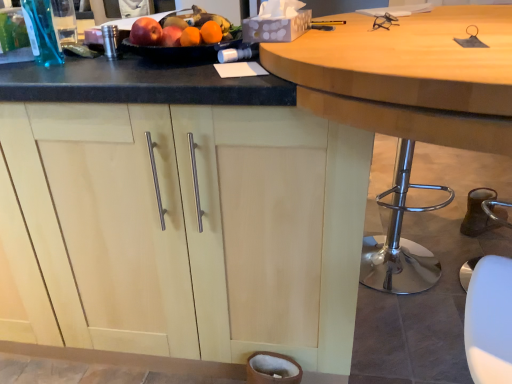
Where is `light wood cabinet at center`? The height and width of the screenshot is (384, 512). light wood cabinet at center is located at coordinates (185, 230).

Does light wood cabinet at center have a greater height compared to wooden table at center?

No, light wood cabinet at center is not taller than wooden table at center.

From a real-world perspective, between light wood cabinet at center and wooden table at center, who is vertically higher?

wooden table at center.

Looking at this image, does light wood cabinet at center have a smaller size compared to wooden table at center?

Yes.

Measure the distance from glossy plastic fruit dish at upper center to wooden table at center.

13.27 inches.

How different are the orientations of glossy plastic fruit dish at upper center and wooden table at center in degrees?

The angular difference between glossy plastic fruit dish at upper center and wooden table at center is 107 degrees.

Considering the relative sizes of glossy plastic fruit dish at upper center and wooden table at center in the image provided, is glossy plastic fruit dish at upper center wider than wooden table at center?

No.

Does point (177, 25) come farther from viewer compared to point (349, 107)?

Yes.

Is glossy plastic fruit dish at upper center located outside light wood cabinet at center?

glossy plastic fruit dish at upper center is positioned outside light wood cabinet at center.

Can you confirm if glossy plastic fruit dish at upper center is thinner than light wood cabinet at center?

Correct, the width of glossy plastic fruit dish at upper center is less than that of light wood cabinet at center.

Based on the photo, how different are the orientations of glossy plastic fruit dish at upper center and light wood cabinet at center in degrees?

There is a 14.8-degree angle between the facing directions of glossy plastic fruit dish at upper center and light wood cabinet at center.

Identify the location of cabinetry on the left of the glossy plastic fruit dish at upper center. (185, 230).

Which is in front, point (443, 80) or point (178, 48)?

Positioned in front is point (443, 80).

Can you confirm if wooden table at center is thinner than glossy plastic fruit dish at upper center?

No.

From a real-world perspective, is wooden table at center positioned under glossy plastic fruit dish at upper center based on gravity?

Indeed, from a real-world perspective, wooden table at center is positioned beneath glossy plastic fruit dish at upper center.

Considering the sizes of objects wooden table at center and glossy plastic fruit dish at upper center in the image provided, who is bigger, wooden table at center or glossy plastic fruit dish at upper center?

Bigger between the two is wooden table at center.

Is wooden table at center oriented away from light wood cabinet at center?

That's right, wooden table at center is facing away from light wood cabinet at center.

Which object is further away from the camera, wooden table at center or light wood cabinet at center?

light wood cabinet at center is behind.

Which object is positioned more to the left, wooden table at center or light wood cabinet at center?

light wood cabinet at center is more to the left.

From the image's perspective, between wooden table at center and light wood cabinet at center, who is located below?

wooden table at center.

Considering the relative sizes of light wood cabinet at center and glossy plastic fruit dish at upper center in the image provided, is light wood cabinet at center wider than glossy plastic fruit dish at upper center?

Yes, light wood cabinet at center is wider than glossy plastic fruit dish at upper center.

Which is nearer, (181, 223) or (225, 43)?

Clearly, point (181, 223) is closer to the camera than point (225, 43).

This screenshot has width=512, height=384. I want to click on cabinetry that appears below the glossy plastic fruit dish at upper center (from a real-world perspective), so pyautogui.click(x=185, y=230).

From the image's perspective, is light wood cabinet at center located above or below glossy plastic fruit dish at upper center?

From the image's perspective, light wood cabinet at center appears below glossy plastic fruit dish at upper center.

Where is `cabinetry on the left side of wooden table at center`? This screenshot has height=384, width=512. cabinetry on the left side of wooden table at center is located at coordinates (185, 230).

I want to click on fruit dish behind the wooden table at center, so (x=189, y=46).

Which object lies nearer to the anchor point glossy plastic fruit dish at upper center, wooden table at center or light wood cabinet at center?

The object closer to glossy plastic fruit dish at upper center is wooden table at center.

Which object lies nearer to the anchor point light wood cabinet at center, wooden table at center or glossy plastic fruit dish at upper center?

glossy plastic fruit dish at upper center is positioned closer to the anchor light wood cabinet at center.

When comparing their distances from wooden table at center, does glossy plastic fruit dish at upper center or light wood cabinet at center seem further?

light wood cabinet at center is positioned further to the anchor wooden table at center.

Which object lies nearer to the anchor point wooden table at center, light wood cabinet at center or glossy plastic fruit dish at upper center?

The object closer to wooden table at center is glossy plastic fruit dish at upper center.

Estimate the real-world distances between objects in this image. Which object is closer to light wood cabinet at center, glossy plastic fruit dish at upper center or wooden table at center?

Among the two, glossy plastic fruit dish at upper center is located nearer to light wood cabinet at center.

When comparing their distances from glossy plastic fruit dish at upper center, does light wood cabinet at center or wooden table at center seem closer?

wooden table at center.

At what (x,y) coordinates should I click in order to perform the action: click on fruit dish located between light wood cabinet at center and wooden table at center in the left-right direction. Please return your answer as a coordinate pair (x, y). This screenshot has height=384, width=512. Looking at the image, I should click on (189, 46).